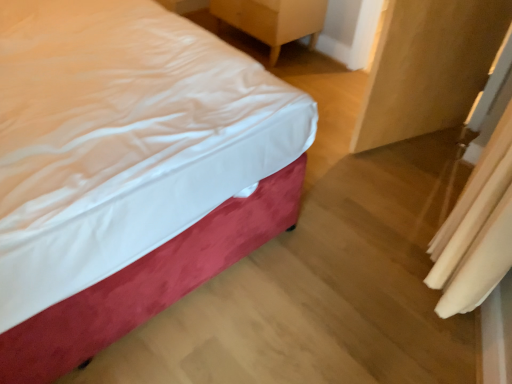
Question: Can you confirm if white fabric curtain at lower right is smaller than wooden nightstand at upper right?

Choices:
 (A) yes
 (B) no

Answer: (A)

Question: Is white fabric curtain at lower right further to the viewer compared to wooden nightstand at upper right?

Choices:
 (A) yes
 (B) no

Answer: (B)

Question: Could you tell me if white fabric curtain at lower right is facing wooden nightstand at upper right?

Choices:
 (A) no
 (B) yes

Answer: (A)

Question: Is wooden nightstand at upper right a part of white fabric curtain at lower right?

Choices:
 (A) no
 (B) yes

Answer: (A)

Question: From a real-world perspective, is white fabric curtain at lower right beneath wooden nightstand at upper right?

Choices:
 (A) no
 (B) yes

Answer: (A)

Question: Can you confirm if white fabric curtain at lower right is positioned to the right of wooden nightstand at upper right?

Choices:
 (A) yes
 (B) no

Answer: (A)

Question: Does white fabric curtain at lower right have a lesser height compared to matte wood armoire at right?

Choices:
 (A) yes
 (B) no

Answer: (A)

Question: Is white fabric curtain at lower right directly adjacent to matte wood armoire at right?

Choices:
 (A) no
 (B) yes

Answer: (A)

Question: Is white fabric curtain at lower right turned away from matte wood armoire at right?

Choices:
 (A) yes
 (B) no

Answer: (B)

Question: Is white fabric curtain at lower right positioned far away from matte wood armoire at right?

Choices:
 (A) yes
 (B) no

Answer: (B)

Question: Considering the relative sizes of white fabric curtain at lower right and matte wood armoire at right in the image provided, is white fabric curtain at lower right bigger than matte wood armoire at right?

Choices:
 (A) no
 (B) yes

Answer: (B)

Question: Is white fabric curtain at lower right at the left side of matte wood armoire at right?

Choices:
 (A) no
 (B) yes

Answer: (B)

Question: Is wooden nightstand at upper right oriented away from velvet-like red bed at left?

Choices:
 (A) yes
 (B) no

Answer: (B)